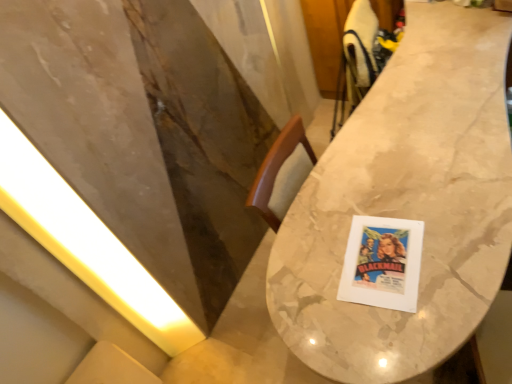
Question: Is yellow matte light at left not inside marble table at center?

Choices:
 (A) no
 (B) yes

Answer: (B)

Question: Can you confirm if yellow matte light at left is smaller than marble table at center?

Choices:
 (A) no
 (B) yes

Answer: (B)

Question: Does yellow matte light at left have a greater height compared to marble table at center?

Choices:
 (A) yes
 (B) no

Answer: (A)

Question: Is yellow matte light at left far from marble table at center?

Choices:
 (A) yes
 (B) no

Answer: (A)

Question: From a real-world perspective, does yellow matte light at left stand above marble table at center?

Choices:
 (A) no
 (B) yes

Answer: (B)

Question: Is marble table at center a part of yellow matte light at left?

Choices:
 (A) no
 (B) yes

Answer: (A)

Question: Considering the relative sizes of marble table at center and yellow matte light at left in the image provided, is marble table at center bigger than yellow matte light at left?

Choices:
 (A) yes
 (B) no

Answer: (A)

Question: Is marble table at center to the right of yellow matte light at left from the viewer's perspective?

Choices:
 (A) yes
 (B) no

Answer: (A)

Question: Does marble table at center have a greater width compared to yellow matte light at left?

Choices:
 (A) no
 (B) yes

Answer: (B)

Question: Is marble table at center positioned beyond the bounds of yellow matte light at left?

Choices:
 (A) yes
 (B) no

Answer: (A)

Question: Is marble table at center smaller than yellow matte light at left?

Choices:
 (A) yes
 (B) no

Answer: (B)

Question: Considering the relative positions of marble table at center and yellow matte light at left in the image provided, is marble table at center in front of yellow matte light at left?

Choices:
 (A) no
 (B) yes

Answer: (B)

Question: Considering the positions of point (481, 14) and point (3, 187), is point (481, 14) closer or farther from the camera than point (3, 187)?

Choices:
 (A) farther
 (B) closer

Answer: (A)